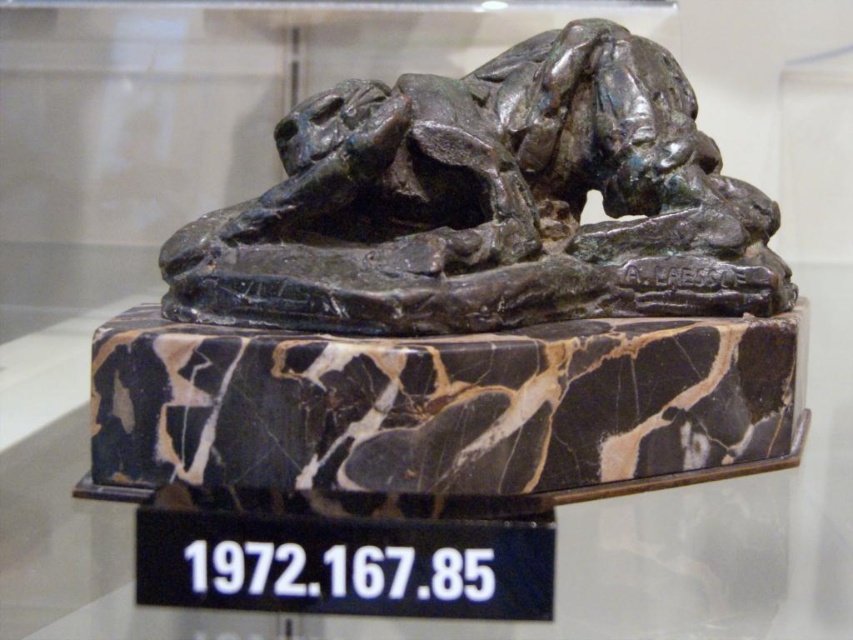
You are an art conservator tasked with measuring the dimensions of the bronze sculpture at center and the marble at center in the museum. Based on the scene, which object has a smaller width?

The bronze sculpture at center has a lesser width compared to marble at center, so the bronze sculpture at center is smaller in width.

You are an art conservator assessing the space between the bronze sculpture at center and the marble at center. Which object takes up more space in the image?

The bronze sculpture at center has a larger size compared to marble at center, so it occupies more space in the image.

You are a museum visitor standing in front of the display. You notice the bronze sculpture at center and the marble at center. Which object is located to the left of the other?

The bronze sculpture at center is positioned on the left side of marble at center.